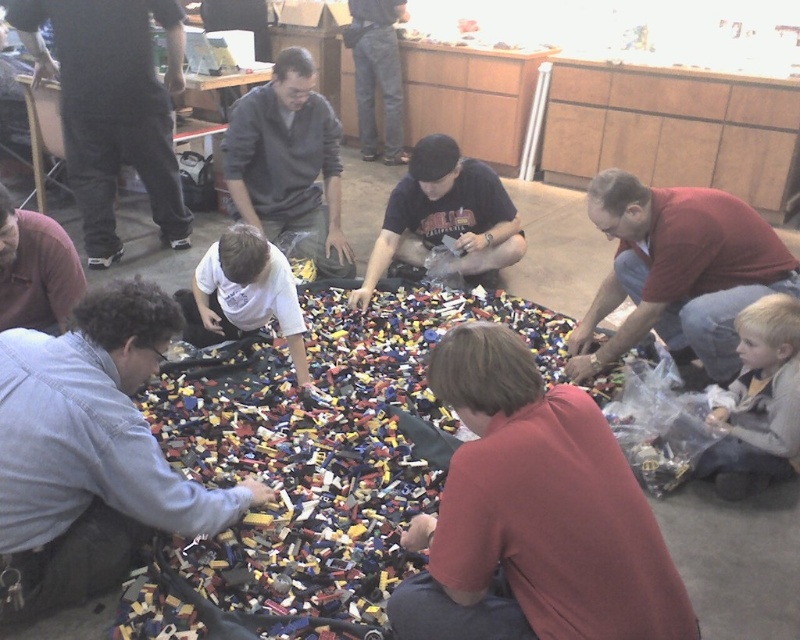
Question: Which of the following is the farthest from the observer?

Choices:
 (A) (409, 509)
 (B) (290, 342)
 (C) (229, 115)
 (D) (404, 212)

Answer: (C)

Question: Which of the following is the farthest from the observer?

Choices:
 (A) matte red shirt at lower right
 (B) denim shirt at lower left
 (C) matte gray shirt at lower left

Answer: (A)

Question: Can you confirm if denim shirt at lower left is positioned to the left of matte gray sweater at center?

Choices:
 (A) yes
 (B) no

Answer: (A)

Question: Is matte red shirt at center to the left of matte red shirt at lower right from the viewer's perspective?

Choices:
 (A) yes
 (B) no

Answer: (A)

Question: Which point is farther to the camera?

Choices:
 (A) denim jeans at upper center
 (B) denim shirt at lower left
 (C) white matte shirt at center

Answer: (A)

Question: Is multicolored plastic bricks at center further to camera compared to blonde hair child at lower right?

Choices:
 (A) no
 (B) yes

Answer: (A)